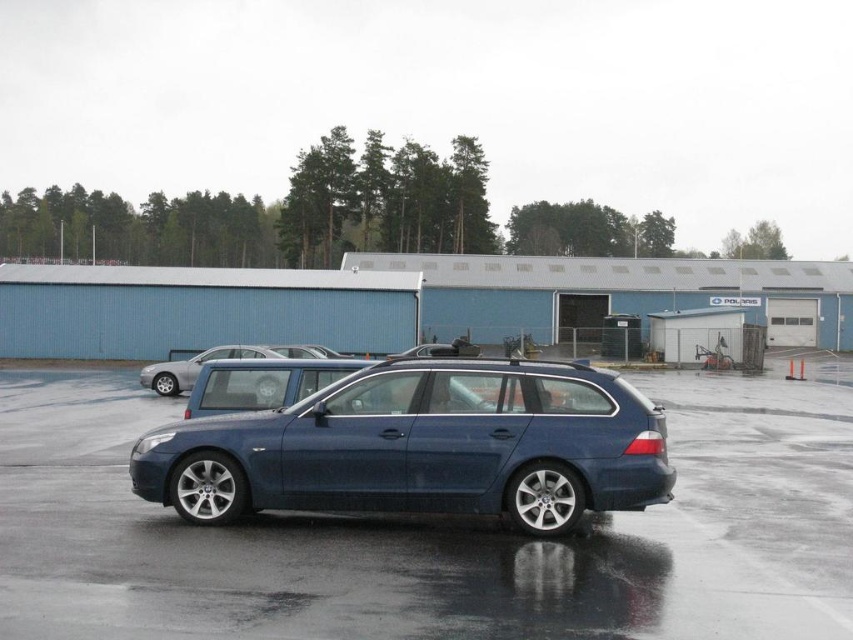
Based on the photo, can you confirm if metallic blue car at center is wider than satin blue wagon at center?

Yes.

Does point (62, 403) lie behind point (189, 502)?

Yes, it is.

Identify the location of metallic blue car at center. This screenshot has height=640, width=853. (436, 534).